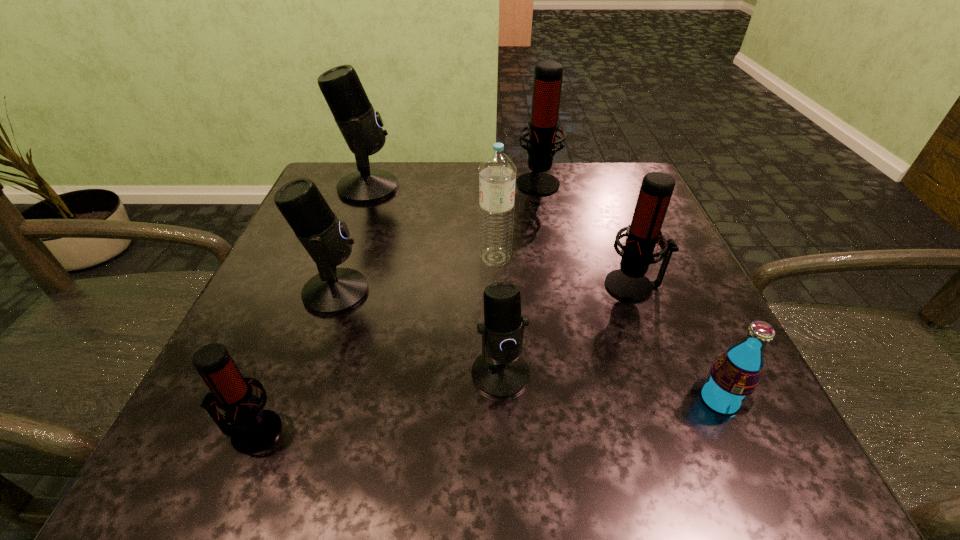
Locate an element on the screen. vacant point located between the second nearest black microphone and the smallest red microphone is located at coordinates (294, 362).

Where is `the third closest object to the second smallest black microphone`? This screenshot has height=540, width=960. the third closest object to the second smallest black microphone is located at coordinates (501, 372).

Locate an element on the screen. The width and height of the screenshot is (960, 540). object that ranks as the fourth closest to the second smallest black microphone is located at coordinates (361, 127).

Select which microphone appears as the second closest to the second biggest red microphone. Please provide its 2D coordinates. Your answer should be formatted as a tuple, i.e. [(x, y)], where the tuple contains the x and y coordinates of a point satisfying the conditions above.

[(548, 75)]

At what (x,y) coordinates should I click in order to perform the action: click on microphone that is the third closest one to the third microphone from right to left. Please return your answer as a coordinate pair (x, y). Looking at the image, I should click on (252, 429).

Point out which red microphone is positioned as the nearest to the sixth nearest object. Please provide its 2D coordinates. Your answer should be formatted as a tuple, i.e. [(x, y)], where the tuple contains the x and y coordinates of a point satisfying the conditions above.

[(628, 283)]

Find the location of a particular element. This screenshot has height=540, width=960. red microphone that stands as the closest to the biggest black microphone is located at coordinates (548, 75).

Where is `black microphone that is the second closest one to the soda`? This screenshot has height=540, width=960. black microphone that is the second closest one to the soda is located at coordinates (333, 290).

This screenshot has width=960, height=540. In order to click on black microphone that is the third closest to the second farthest red microphone in this screenshot , I will do `click(361, 127)`.

Identify the location of free spot that satisfies the following two spatial constraints: 1. on the front side of the rightmost red microphone; 2. on the stand of the second smallest black microphone. (636, 292).